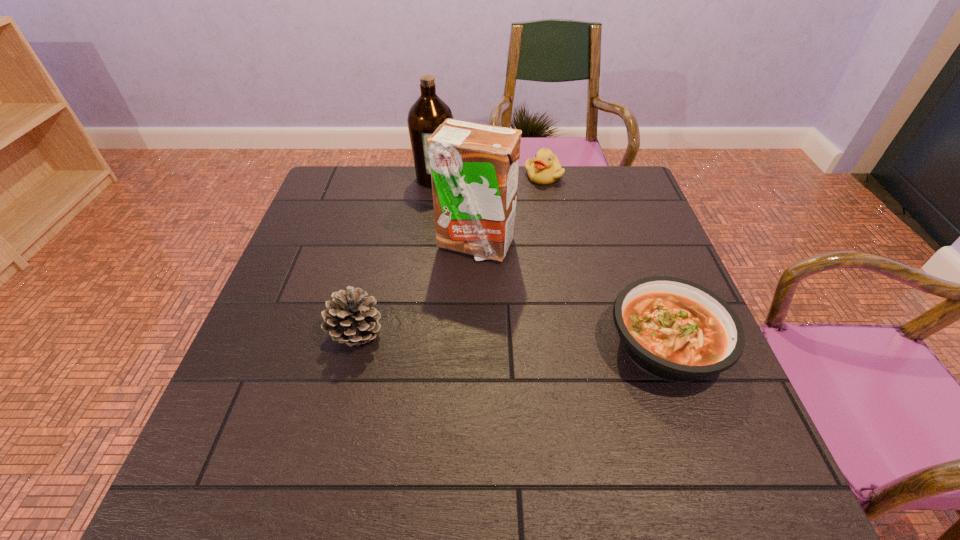
Find the location of a particular element. The width and height of the screenshot is (960, 540). free space located 0.250m on the straw side of the carton is located at coordinates (536, 336).

Find the location of a particular element. Image resolution: width=960 pixels, height=540 pixels. vacant space positioned on the straw side of the carton is located at coordinates (561, 376).

Locate an element on the screen. Image resolution: width=960 pixels, height=540 pixels. vacant space located on the straw side of the carton is located at coordinates (544, 350).

Find the location of a particular element. This screenshot has width=960, height=540. free spot located on the front-facing side of the duckling is located at coordinates click(x=536, y=244).

Identify the location of vacant space located 0.320m on the front-facing side of the duckling. (534, 254).

At what (x,y) coordinates should I click in order to perform the action: click on vacant space located 0.230m on the front-facing side of the duckling. Please return your answer as a coordinate pair (x, y). The image size is (960, 540). Looking at the image, I should click on (537, 232).

Identify the location of olive oil that is at the far edge. (429, 111).

Image resolution: width=960 pixels, height=540 pixels. I want to click on duckling situated at the far edge, so click(x=544, y=169).

Where is `object that is at the near edge`? object that is at the near edge is located at coordinates (673, 329).

Locate an element on the screen. The width and height of the screenshot is (960, 540). object that is at the left edge is located at coordinates (351, 319).